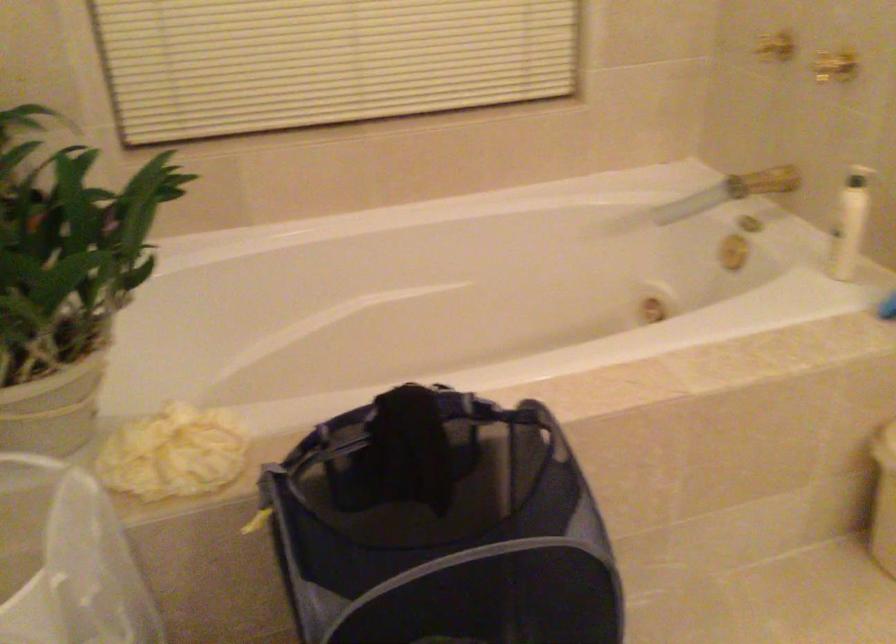
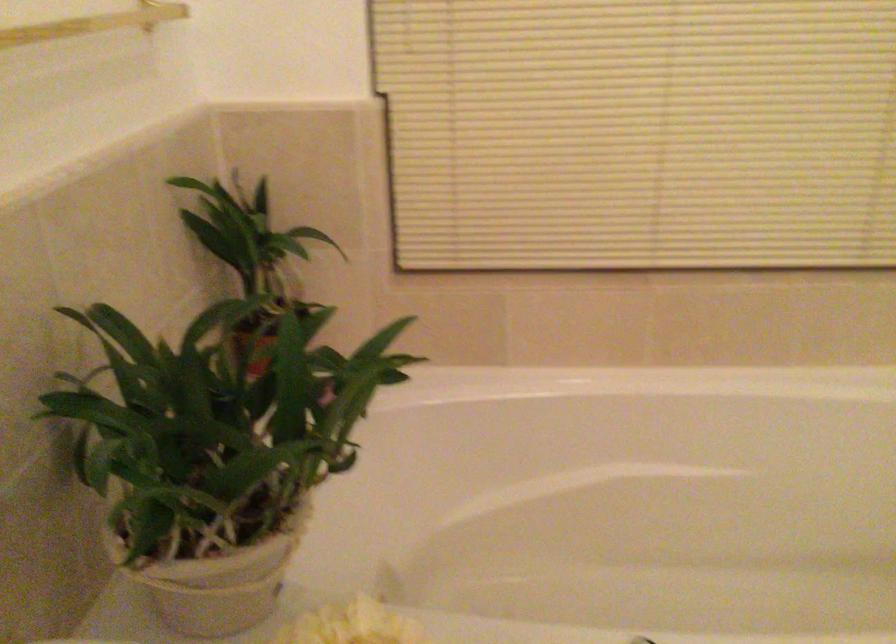
Locate, in the second image, the point that corresponds to the point at 176,420 in the first image.

(351, 625)